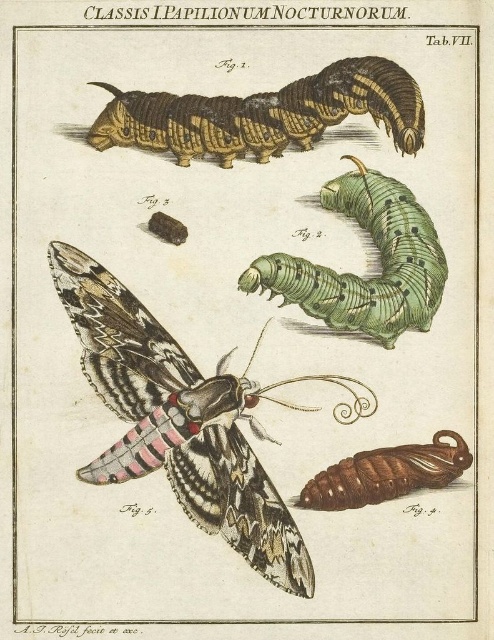
Based on the provided botanical illustration of a nocturnal butterfly life cycle, where exactly is the brown textured caterpillar at upper left located in terms of coordinates?

The brown textured caterpillar at upper left is located at point (264, 115).

You are standing 1.44 meters away from the point labeled as point [126,339]. If you want to move closer to it, which direction should you walk?

You should walk towards the point labeled as point [126,339] to reduce the distance between you and it.

You are a researcher analyzing the life cycle of nocturnal butterflies. In the image provided, you observe the speckled brown butterfly at center and the green matte caterpillar at center. Which of these two has a greater wingspan?

The speckled brown butterfly at center has a larger size compared to the green matte caterpillar at center, so it has a greater wingspan.